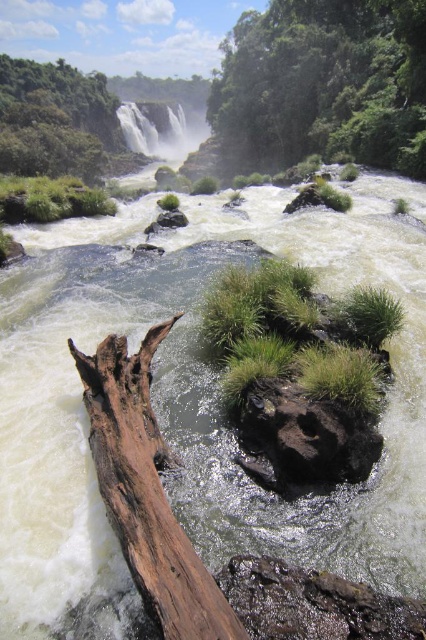
You are standing at the center of the image and want to cross the river to reach the waterfall. The brown rough tree trunk at lower left is partially submerged. Is the tree trunk closer to you or farther away from you compared to the waterfall?

The brown rough tree trunk at lower left is closer to you because it is located at point (146,492), which is in the lower left foreground of the image, whereas the waterfall is in the background.

From the picture: You are a hiker trying to cross the river using the objects in the scene. Which object, the brown rough tree trunk at lower left or the black rough rock at center, would be more stable to step on?

The brown rough tree trunk at lower left is taller than the black rough rock at center, so it would provide a more stable stepping surface when crossing the river.

You are a hiker trying to cross the river using the objects in the scene. Can you step from the brown rough tree trunk at lower left onto the black rough rock at center without getting wet?

The brown rough tree trunk at lower left is positioned on the left side of black rough rock at center, so yes, you can step from the brown rough tree trunk at lower left onto the black rough rock at center without getting wet because they are adjacent to each other.